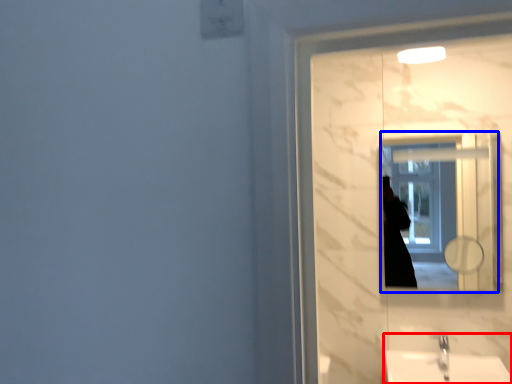
Question: Which point is closer to the camera, sink (highlighted by a red box) or mirror (highlighted by a blue box)?

Choices:
 (A) sink
 (B) mirror

Answer: (A)